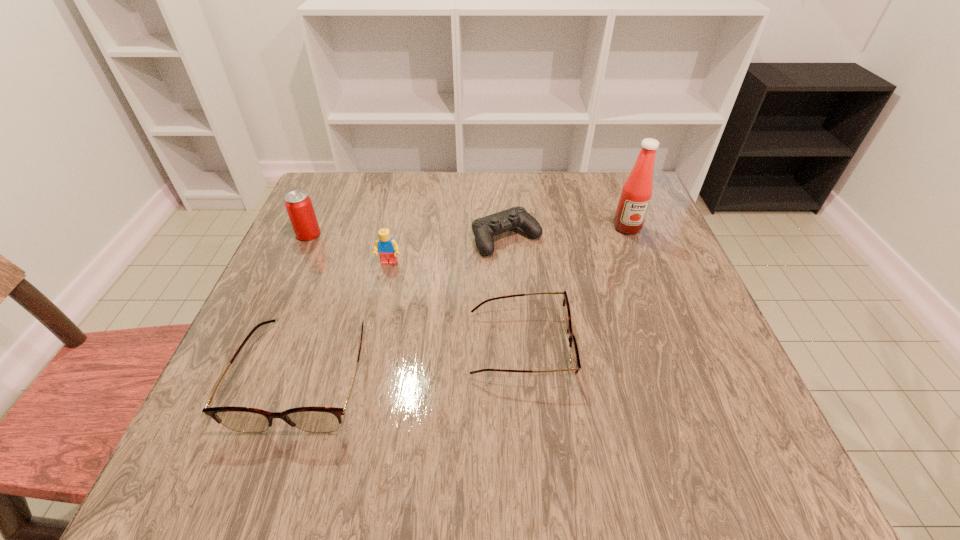
At what (x,y) coordinates should I click in order to perform the action: click on vacant space located 0.220m on the back of the can. Please return your answer as a coordinate pair (x, y). The width and height of the screenshot is (960, 540). Looking at the image, I should click on (333, 180).

You are a GUI agent. You are given a task and a screenshot of the screen. Output one action in this format:
    pyautogui.click(x=<x>, y=<y>)
    Task: Click on the free point located 0.080m on the front-facing side of the Lego
    Image resolution: width=960 pixels, height=540 pixels.
    Given the screenshot: What is the action you would take?
    pyautogui.click(x=382, y=294)

Identify the location of vacant area situated 0.240m on the left of the control. The width and height of the screenshot is (960, 540). (373, 238).

This screenshot has height=540, width=960. Find the location of `condiment that is at the far edge`. condiment that is at the far edge is located at coordinates (636, 193).

The height and width of the screenshot is (540, 960). I want to click on control situated at the far edge, so click(484, 228).

This screenshot has height=540, width=960. Find the location of `spectacles that is at the left edge`. spectacles that is at the left edge is located at coordinates (313, 419).

At what (x,y) coordinates should I click in order to perform the action: click on can that is at the left edge. Please return your answer as a coordinate pair (x, y). This screenshot has height=540, width=960. Looking at the image, I should click on (298, 204).

Where is `object positioned at the right edge`? object positioned at the right edge is located at coordinates (636, 193).

Where is `object present at the near left corner`? Image resolution: width=960 pixels, height=540 pixels. object present at the near left corner is located at coordinates (313, 419).

What are the coordinates of `object positioned at the far right corner` in the screenshot? It's located at (636, 193).